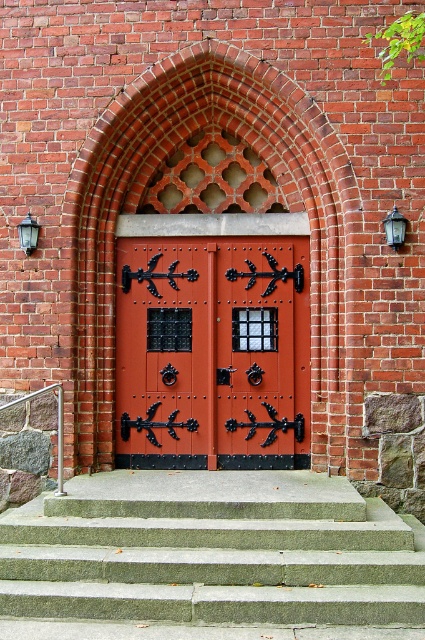
Who is positioned more to the left, gray concrete stairs at center or red brick archway at center?

gray concrete stairs at center

Can you confirm if gray concrete stairs at center is smaller than red brick archway at center?

Indeed, gray concrete stairs at center has a smaller size compared to red brick archway at center.

Between point (127, 550) and point (342, 157), which one is positioned in front?

Point (127, 550) is more forward.

Find the location of a particular element. The height and width of the screenshot is (640, 425). gray concrete stairs at center is located at coordinates (206, 557).

Is red brick archway at center thinner than metallic silver railing at lower left?

No.

Who is more distant from viewer, (226, 58) or (59, 460)?

The point (226, 58) is more distant.

Measure the distance between red brick archway at center and camera.

5.99 meters

Locate an element on the screen. red brick archway at center is located at coordinates (152, 173).

Describe the element at coordinates (206, 557) in the screenshot. The width and height of the screenshot is (425, 640). I see `gray concrete stairs at center` at that location.

Image resolution: width=425 pixels, height=640 pixels. Identify the location of gray concrete stairs at center. tap(206, 557).

At what (x,y) coordinates should I click in order to perform the action: click on gray concrete stairs at center. Please return your answer as a coordinate pair (x, y). This screenshot has height=640, width=425. Looking at the image, I should click on (206, 557).